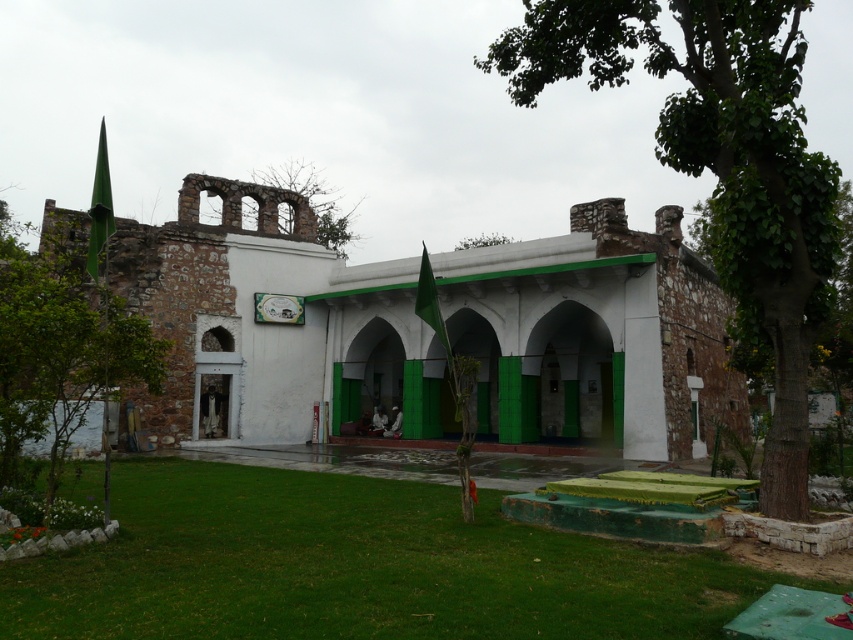
Does green leafy tree at center appear on the left side of green leafy tree at upper center?

No, green leafy tree at center is not to the left of green leafy tree at upper center.

Is green leafy tree at center wider than green leafy tree at upper center?

Correct, the width of green leafy tree at center exceeds that of green leafy tree at upper center.

Locate an element on the screen. The image size is (853, 640). green leafy tree at center is located at coordinates (720, 166).

Between point (287, 168) and point (495, 241), which one is positioned in front?

Point (495, 241) is in front.

The width and height of the screenshot is (853, 640). What are the coordinates of `bare branches at upper center` in the screenshot? It's located at (312, 200).

Image resolution: width=853 pixels, height=640 pixels. Identify the location of bare branches at upper center. (312, 200).

Which is in front, point (20, 285) or point (276, 173)?

Point (20, 285) is in front.

Where is `green leafy tree at left`? Image resolution: width=853 pixels, height=640 pixels. green leafy tree at left is located at coordinates (59, 355).

Does point (51, 284) come in front of point (345, 236)?

Yes, point (51, 284) is closer to viewer.

Where is `green leafy tree at left`? green leafy tree at left is located at coordinates click(x=59, y=355).